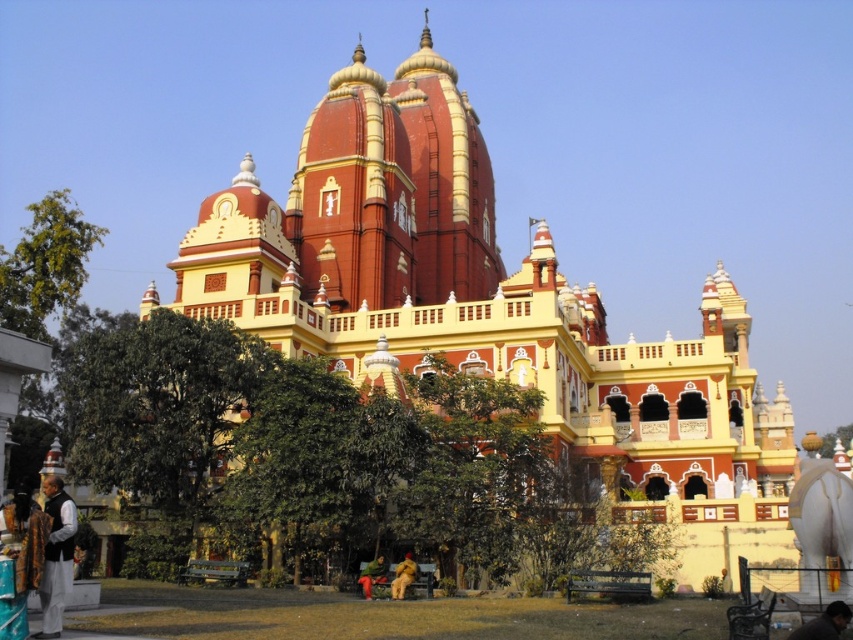
You are standing on the lawn in front of the grand building. You see a golden fabric person at lower center and a green fabric cloth at lower center. Which object is positioned to the right when viewed from your perspective?

The golden fabric person at lower center is positioned to the right of the green fabric cloth at lower center.

You are standing on the lawn in front of the grand building. You see a dark brown fabric at lower left and a golden fabric person at lower center. Which object is closer to the left edge of the lawn?

The dark brown fabric at lower left is positioned on the left side of golden fabric person at lower center, so it is closer to the left edge of the lawn.